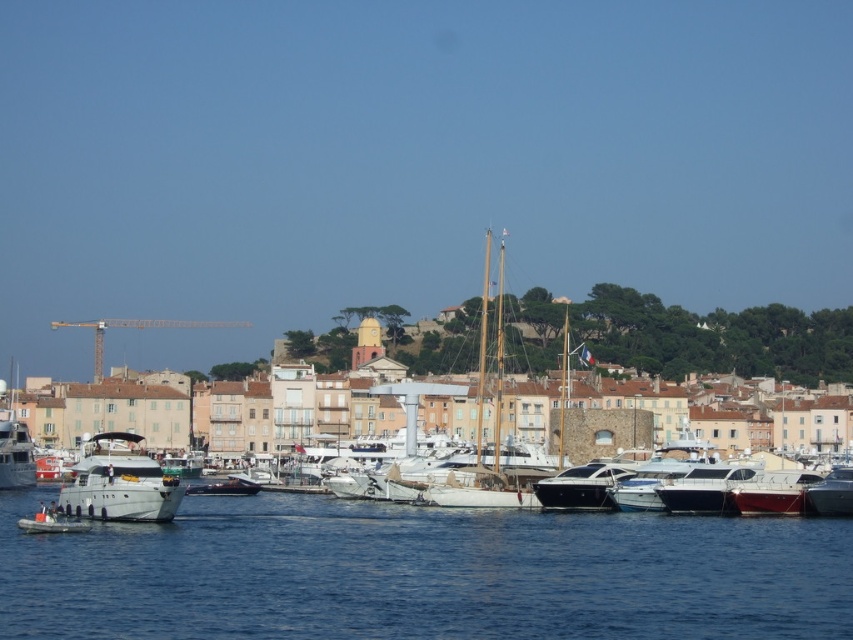
Question: Which object is closer to the camera taking this photo?

Choices:
 (A) silver metallic yacht at lower left
 (B) blue water at lower center

Answer: (B)

Question: Which is farther from the blue water at lower center?

Choices:
 (A) silver metallic yacht at lower left
 (B) shiny black yacht at center
 (C) shiny white boat at center right
 (D) shiny silver yacht at lower right

Answer: (D)

Question: Does blue water at lower center have a lesser width compared to shiny silver yacht at lower right?

Choices:
 (A) no
 (B) yes

Answer: (A)

Question: Where is silver metallic yacht at lower left located in relation to shiny black yacht at center in the image?

Choices:
 (A) below
 (B) above

Answer: (A)

Question: Does silver metallic yacht at lower left appear under shiny black yacht at center?

Choices:
 (A) no
 (B) yes

Answer: (B)

Question: Which is farther from the shiny silver yacht at lower right?

Choices:
 (A) shiny white boat at center right
 (B) silver metallic yacht at lower left
 (C) blue water at lower center
 (D) shiny black yacht at center

Answer: (B)